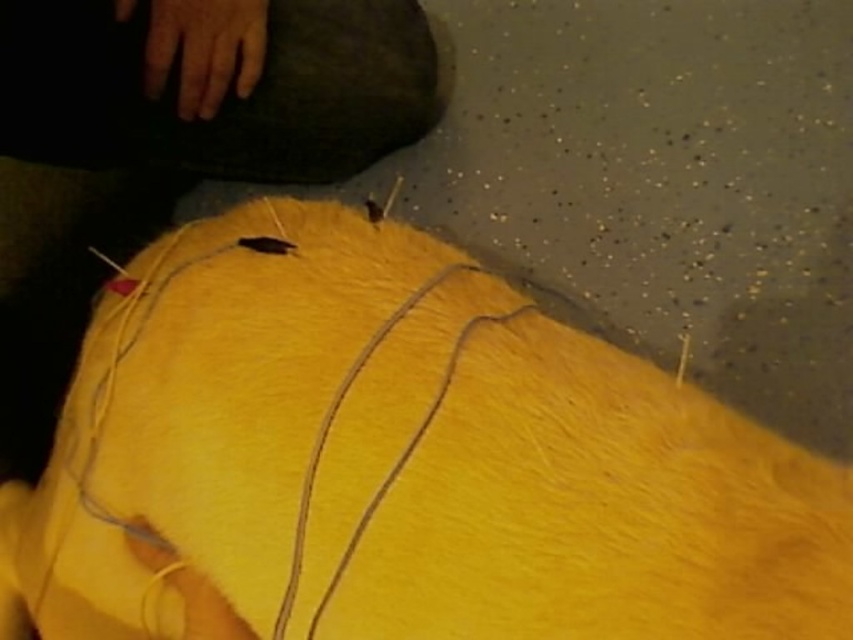
You are a tailor working on a project. You need to place the yellow fabric at center onto a sewing machine that is located 20 inches away from your current position. Can you reach the fabric without moving your hand from the dark textured object?

The yellow fabric at center is 21.32 inches away from the dark textured object. Since the sewing machine is only 20 inches away, you can reach it without moving your hand.

You are a tailor working on a project and need to locate the yellow fabric at center and the yellow fabric string at center. According to the image, which one is positioned lower?

The yellow fabric at center is positioned lower than the yellow fabric string at center.